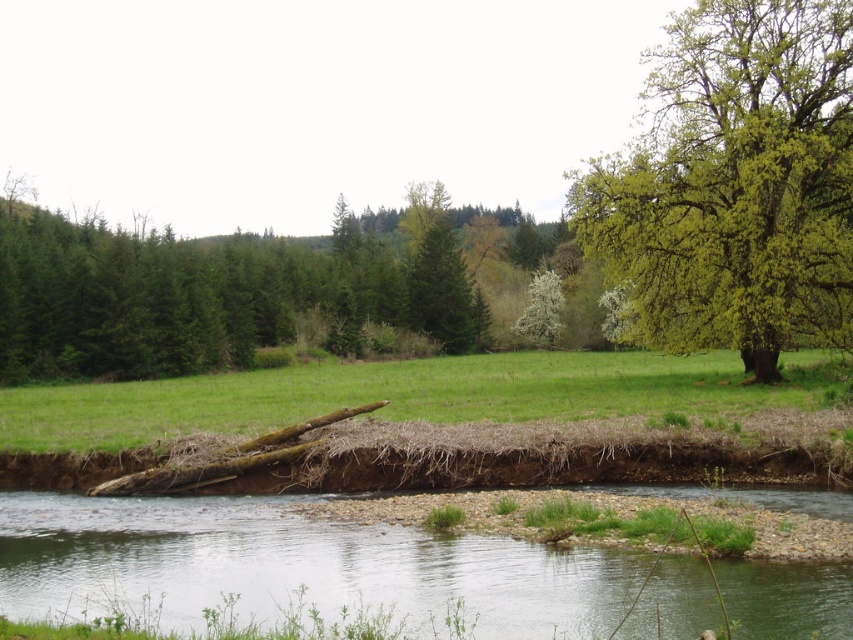
Question: Is clear water at center above green leafy tree at upper center?

Choices:
 (A) no
 (B) yes

Answer: (A)

Question: Among these objects, which one is farthest from the camera?

Choices:
 (A) green matte tree at center
 (B) white blossoming tree at center
 (C) clear water at center
 (D) green grassy at center

Answer: (B)

Question: In this image, where is clear water at center located relative to green leafy tree at upper center?

Choices:
 (A) above
 (B) below

Answer: (B)

Question: Does clear water at center come in front of white blossoming tree at center?

Choices:
 (A) yes
 (B) no

Answer: (A)

Question: Which object is closer to the camera taking this photo?

Choices:
 (A) green matte tree at center
 (B) white blossoming tree at center
 (C) green leafy tree at right

Answer: (C)

Question: Which object is positioned closest to the clear water at center?

Choices:
 (A) green leafy tree at right
 (B) green matte tree at center
 (C) green leafy tree at upper center

Answer: (A)